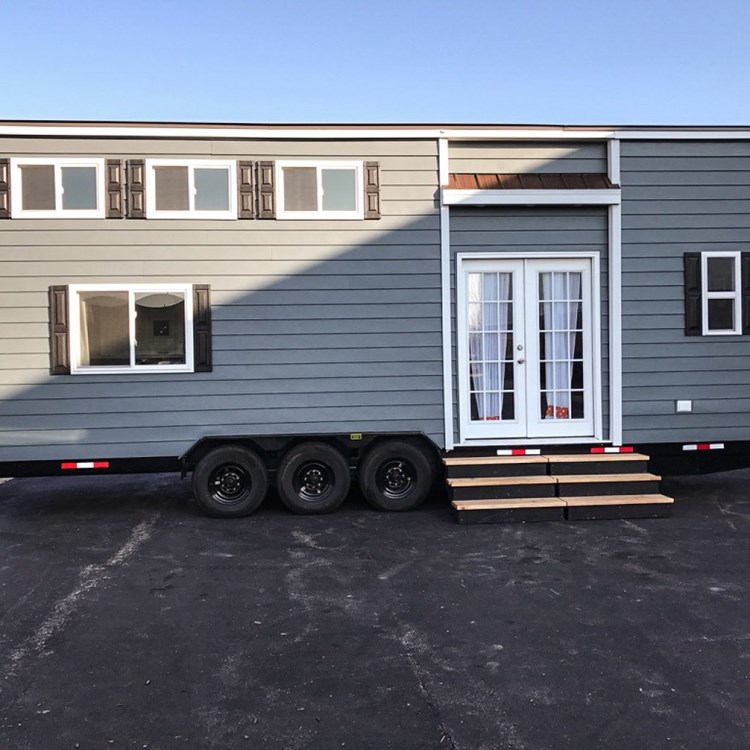
I want to click on windows, so click(94, 313), click(168, 324), click(46, 186), click(91, 190), click(172, 190), click(224, 195), click(308, 184), click(330, 199), click(730, 272), click(720, 320).